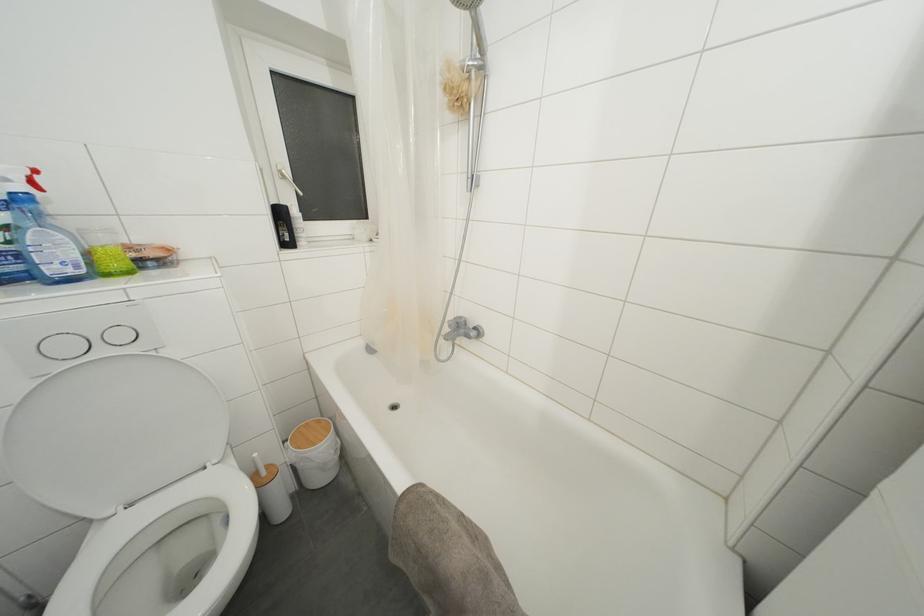
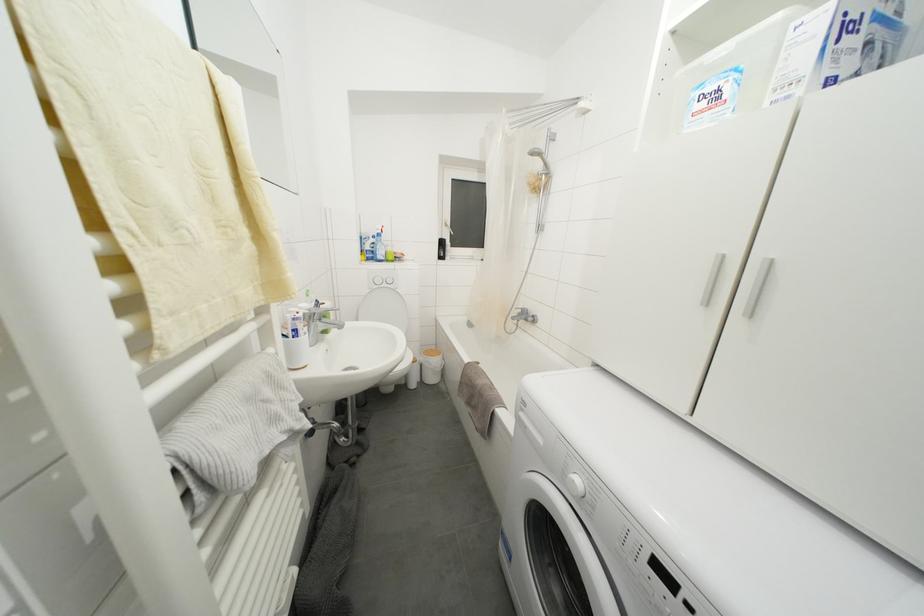
Question: The images are taken continuously from a first-person perspective. In which direction is your viewpoint rotating?

Choices:
 (A) Left
 (B) Right
 (C) Up
 (D) Down

Answer: (A)